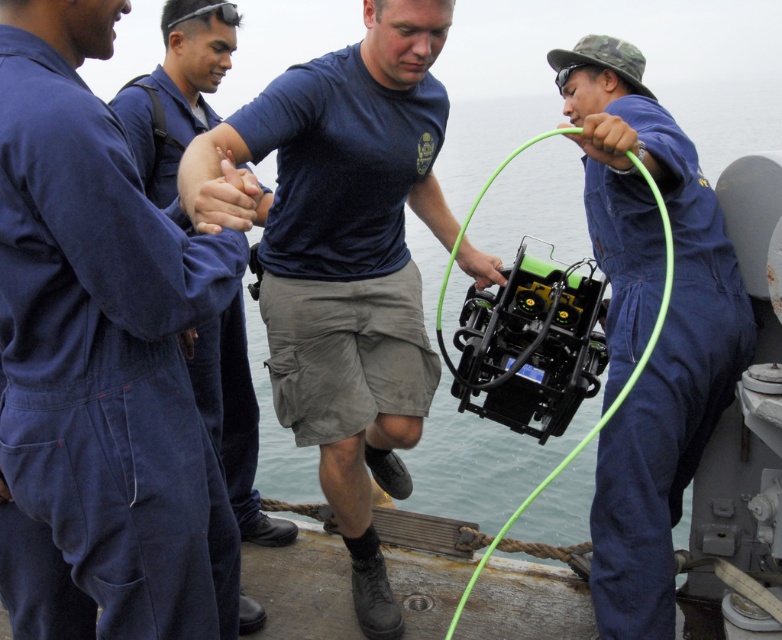
Question: Is dark blue t-shirt at center positioned before matte blue jumpsuit at center?

Choices:
 (A) no
 (B) yes

Answer: (B)

Question: Which object appears farthest from the camera in this image?

Choices:
 (A) matte blue jumpsuit at center
 (B) dark blue t-shirt at center
 (C) blue coveralls at right

Answer: (A)

Question: Based on their relative distances, which object is farther from the blue coveralls at right?

Choices:
 (A) matte blue jumpsuit at center
 (B) dark blue t-shirt at center

Answer: (A)

Question: Which of the following is the closest to the observer?

Choices:
 (A) blue coveralls at right
 (B) matte blue jumpsuit at center

Answer: (A)

Question: Does blue coveralls at right come in front of matte blue jumpsuit at center?

Choices:
 (A) no
 (B) yes

Answer: (B)

Question: Can you confirm if dark blue t-shirt at center is positioned above matte blue jumpsuit at center?

Choices:
 (A) no
 (B) yes

Answer: (B)